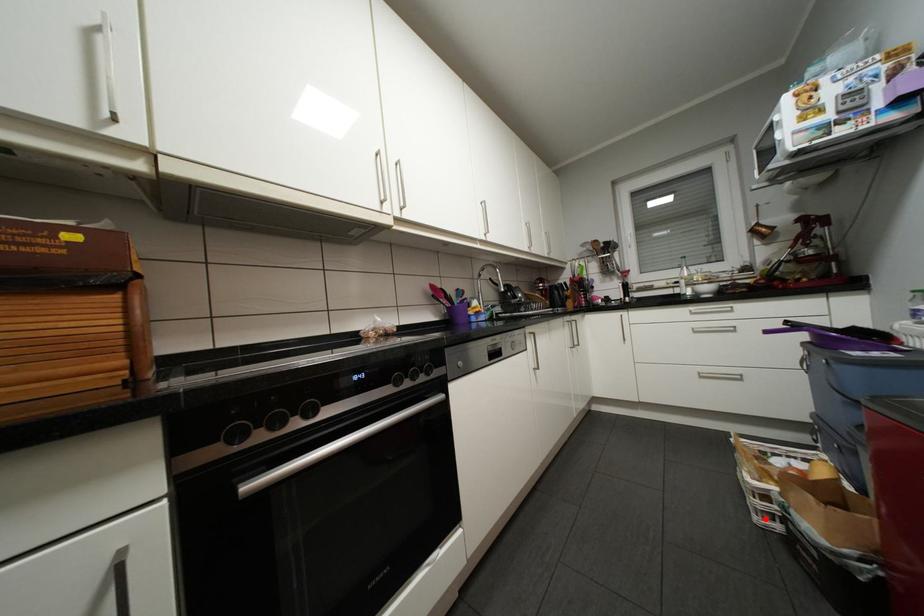
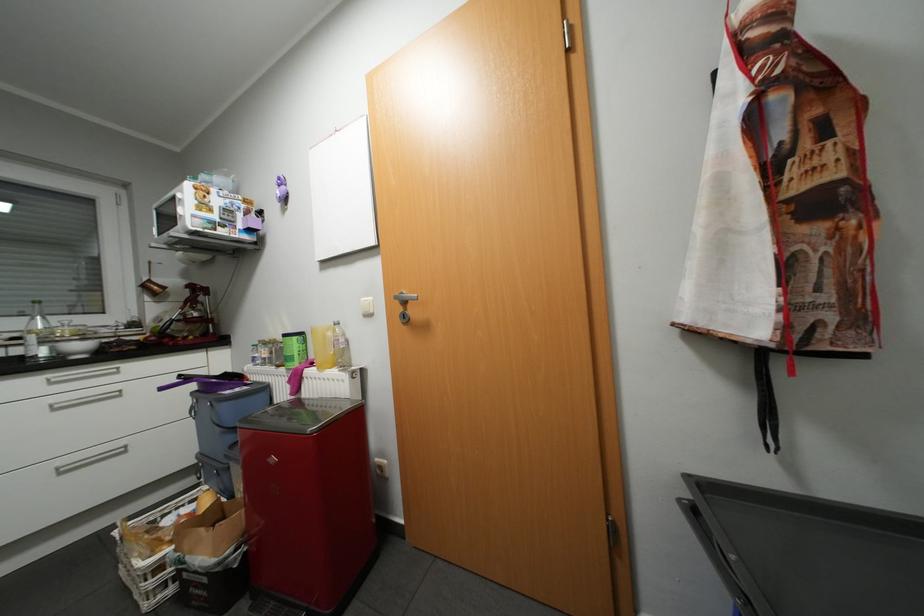
Question: I am providing you with two images of the same scene from different viewpoints. In image1, a red point is highlighted. Considering the same 3D point in image2, which of the following is correct?

Choices:
 (A) It is closer
 (B) It is farther

Answer: (A)